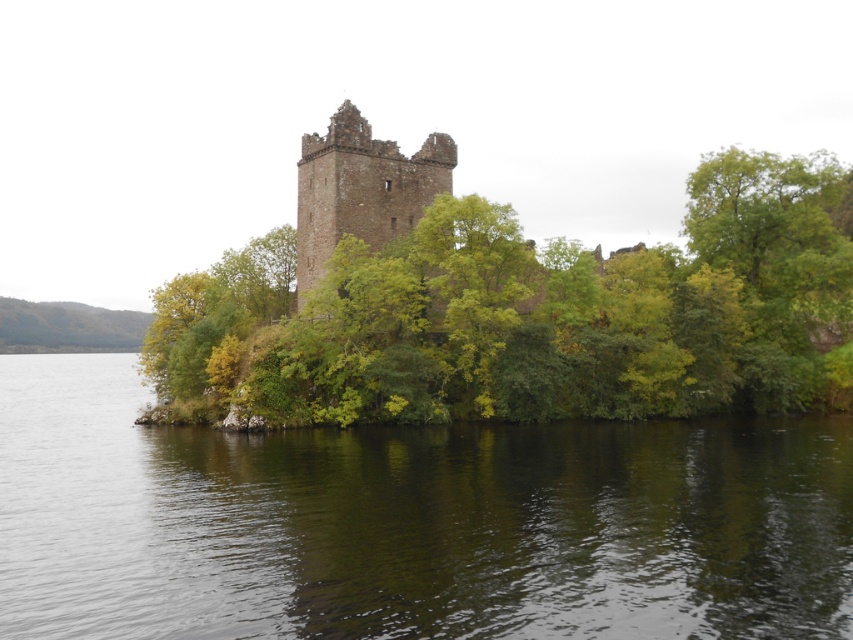
Which is in front, point (750, 609) or point (601, 385)?

Point (750, 609) is in front.

Which is below, dark green water at center or green leafy tree at center?

dark green water at center is below.

Which is in front, point (409, 445) or point (776, 160)?

Point (409, 445)

You are a GUI agent. You are given a task and a screenshot of the screen. Output one action in this format:
    pyautogui.click(x=<x>, y=<y>)
    Task: Click on the dark green water at center
    This screenshot has width=853, height=640.
    Given the screenshot: What is the action you would take?
    pyautogui.click(x=410, y=524)

This screenshot has height=640, width=853. What do you see at coordinates (532, 314) in the screenshot?
I see `green leafy tree at center` at bounding box center [532, 314].

Is green leafy tree at center smaller than brown stone tower at center?

No, green leafy tree at center is not smaller than brown stone tower at center.

What do you see at coordinates (532, 314) in the screenshot? I see `green leafy tree at center` at bounding box center [532, 314].

You are a GUI agent. You are given a task and a screenshot of the screen. Output one action in this format:
    pyautogui.click(x=<x>, y=<y>)
    Task: Click on the green leafy tree at center
    
    Given the screenshot: What is the action you would take?
    pyautogui.click(x=532, y=314)

Does dark green water at center appear over brown stone tower at center?

No, dark green water at center is not above brown stone tower at center.

Can you confirm if dark green water at center is bigger than brown stone tower at center?

Yes.

Who is more distant from viewer, (120, 483) or (433, 147)?

The point (433, 147) is behind.

This screenshot has width=853, height=640. Find the location of `dark green water at center`. dark green water at center is located at coordinates (410, 524).